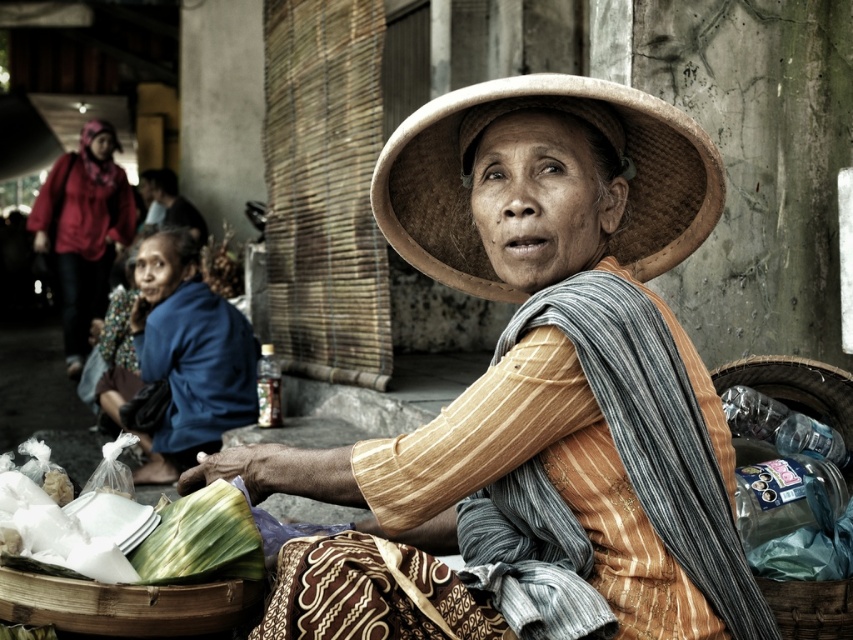
Question: Does blue fabric at lower left have a lesser width compared to brown woven basket at lower right?

Choices:
 (A) yes
 (B) no

Answer: (B)

Question: Which of these objects is positioned farthest from the white plastic bag at lower left?

Choices:
 (A) brown woven straw hat at center
 (B) brown woven basket at lower right
 (C) blue fabric at lower left
 (D) matte straw hat at center

Answer: (C)

Question: Does matte straw hat at center have a greater width compared to white plastic bag at lower left?

Choices:
 (A) yes
 (B) no

Answer: (A)

Question: Estimate the real-world distances between objects in this image. Which object is closer to the brown woven straw hat at center?

Choices:
 (A) brown woven basket at lower right
 (B) blue fabric at lower left

Answer: (A)

Question: Which point is closer to the camera?

Choices:
 (A) (784, 387)
 (B) (433, 461)
 (C) (189, 456)

Answer: (B)

Question: Does matte red jacket at upper left appear over brown woven basket at lower right?

Choices:
 (A) no
 (B) yes

Answer: (B)